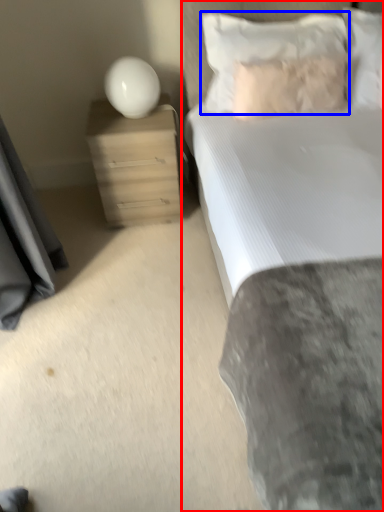
Question: Which object is further to the camera taking this photo, bed (highlighted by a red box) or pillow (highlighted by a blue box)?

Choices:
 (A) bed
 (B) pillow

Answer: (B)